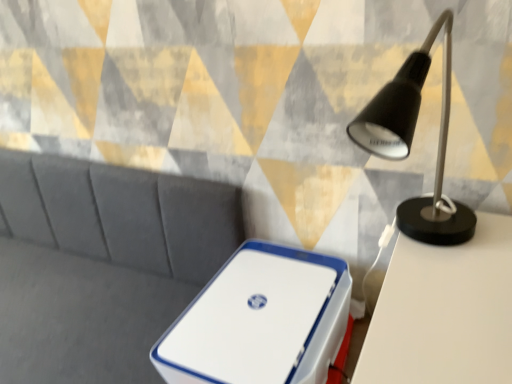
Question: Does black matte desk lamp at upper right have a larger size compared to white plastic storage box at center?

Choices:
 (A) yes
 (B) no

Answer: (A)

Question: Can you confirm if black matte desk lamp at upper right is smaller than white plastic storage box at center?

Choices:
 (A) no
 (B) yes

Answer: (A)

Question: From a real-world perspective, is black matte desk lamp at upper right on top of white plastic storage box at center?

Choices:
 (A) no
 (B) yes

Answer: (B)

Question: Is black matte desk lamp at upper right positioned far away from white plastic storage box at center?

Choices:
 (A) no
 (B) yes

Answer: (A)

Question: Is the surface of black matte desk lamp at upper right in direct contact with white plastic storage box at center?

Choices:
 (A) yes
 (B) no

Answer: (B)

Question: Considering the relative sizes of black matte desk lamp at upper right and white plastic storage box at center in the image provided, is black matte desk lamp at upper right shorter than white plastic storage box at center?

Choices:
 (A) no
 (B) yes

Answer: (A)

Question: Can you confirm if white plastic storage box at center is shorter than black matte desk lamp at upper right?

Choices:
 (A) yes
 (B) no

Answer: (A)

Question: Can you confirm if white plastic storage box at center is taller than black matte desk lamp at upper right?

Choices:
 (A) no
 (B) yes

Answer: (A)

Question: Is white plastic storage box at center completely or partially outside of black matte desk lamp at upper right?

Choices:
 (A) yes
 (B) no

Answer: (A)

Question: From the image's perspective, does white plastic storage box at center appear lower than black matte desk lamp at upper right?

Choices:
 (A) no
 (B) yes

Answer: (B)

Question: Are white plastic storage box at center and black matte desk lamp at upper right located far from each other?

Choices:
 (A) yes
 (B) no

Answer: (B)

Question: Is white plastic storage box at center to the right of black matte desk lamp at upper right from the viewer's perspective?

Choices:
 (A) yes
 (B) no

Answer: (B)

Question: In terms of width, does black matte desk lamp at upper right look wider or thinner when compared to white plastic storage box at center?

Choices:
 (A) thin
 (B) wide

Answer: (B)